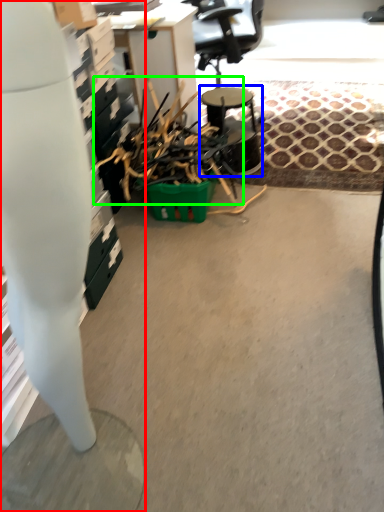
Question: Which object is the farthest from desk (highlighted by a red box)? Choose among these: round table (highlighted by a blue box) or debris (highlighted by a green box).

Choices:
 (A) round table
 (B) debris

Answer: (A)